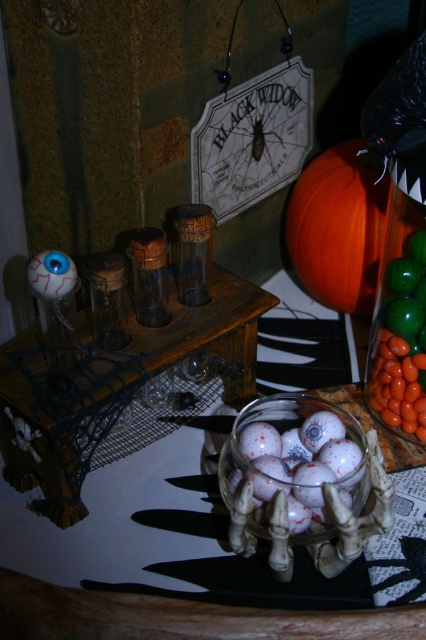
Can you confirm if orange matte pumpkin at upper right is thinner than translucent glass candy at right?

In fact, orange matte pumpkin at upper right might be wider than translucent glass candy at right.

Between point (310, 284) and point (419, 369), which one is positioned in front?

Point (419, 369) is more forward.

I want to click on orange matte pumpkin at upper right, so click(x=339, y=227).

In the scene shown: Is translucent glass table at center further to the viewer compared to orange matte pumpkin at upper right?

No, translucent glass table at center is closer to the viewer.

Between point (166, 630) and point (291, 198), which one is positioned in front?

Point (166, 630)

Which is in front, point (23, 593) or point (298, 189)?

Positioned in front is point (23, 593).

I want to click on translucent glass table at center, so pyautogui.click(x=178, y=618).

Who is more forward, (253, 621) or (376, 403)?

Point (253, 621)

This screenshot has width=426, height=640. I want to click on translucent glass table at center, so click(178, 618).

Find the location of a particular element. translucent glass table at center is located at coordinates (178, 618).